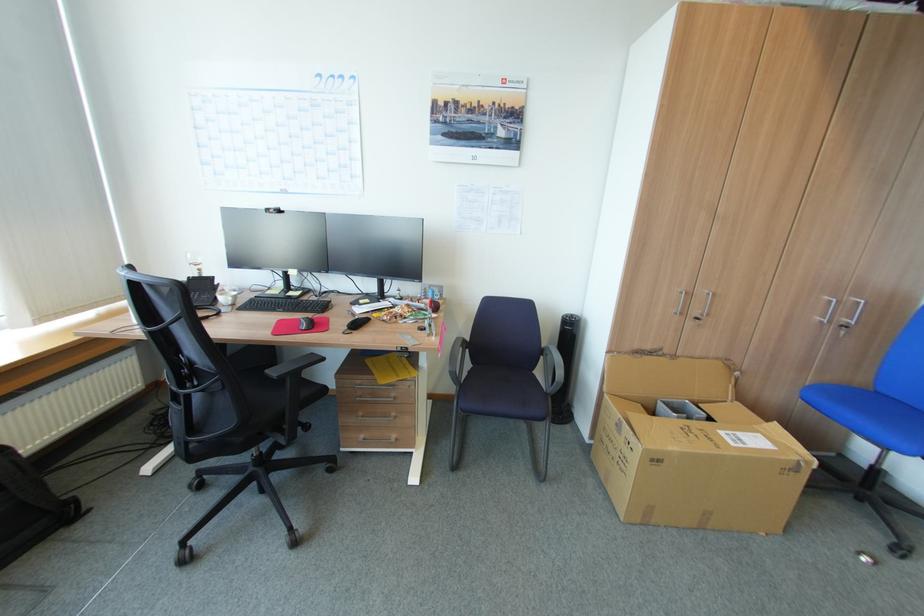
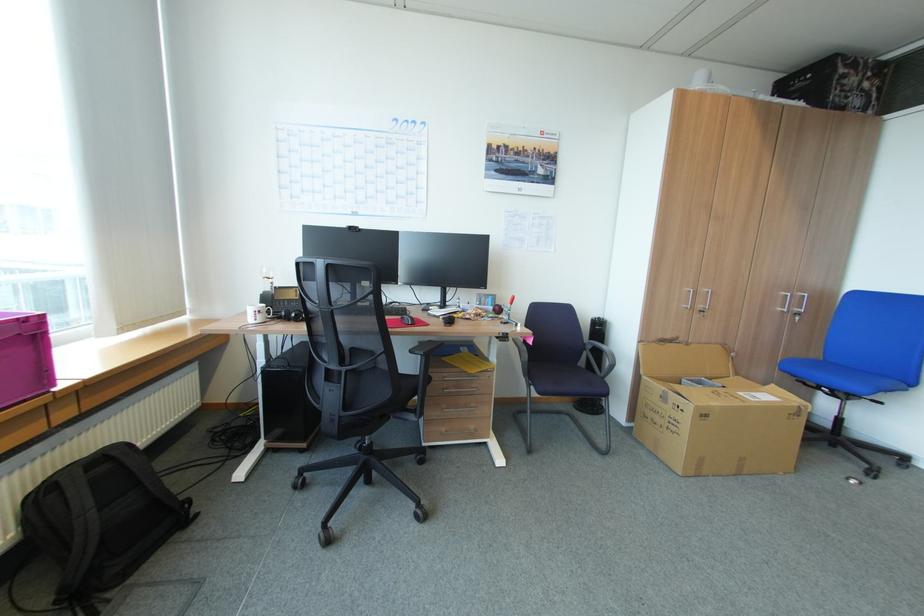
In the second image, find the point that corresponds to point (822, 318) in the first image.

(785, 309)